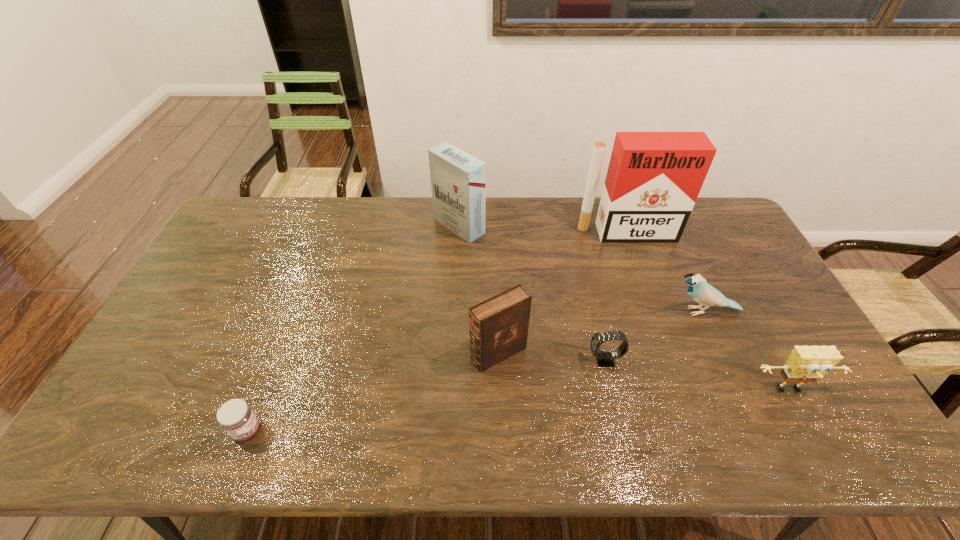
This screenshot has width=960, height=540. I want to click on free space located on the front-facing side of the taller cigarette case, so click(x=656, y=314).

Locate an element on the screen. free space located on the front of the left cigarette case is located at coordinates (455, 298).

This screenshot has height=540, width=960. What are the coordinates of `free space located 0.370m on the left of the Bible` in the screenshot? It's located at (335, 354).

At what (x,y) coordinates should I click in order to perform the action: click on free spot located 0.120m at the face of the bird. Please return your answer as a coordinate pair (x, y). Looking at the image, I should click on (628, 311).

The image size is (960, 540). I want to click on vacant space positioned 0.390m at the face of the bird, so click(538, 311).

Image resolution: width=960 pixels, height=540 pixels. What are the coordinates of `free region located at the face of the bird` in the screenshot? It's located at pyautogui.click(x=574, y=311).

At what (x,y) coordinates should I click in order to perform the action: click on vacant space located 0.060m on the face of the sixth farthest object. Please return your answer as a coordinate pair (x, y). Looking at the image, I should click on (809, 426).

Identify the location of vacant region located on the face of the second shortest object. (529, 361).

I want to click on vacant region located on the face of the second shortest object, so click(x=525, y=361).

Identify the location of vacant point located 0.310m on the face of the second shortest object. This screenshot has width=960, height=540. (473, 361).